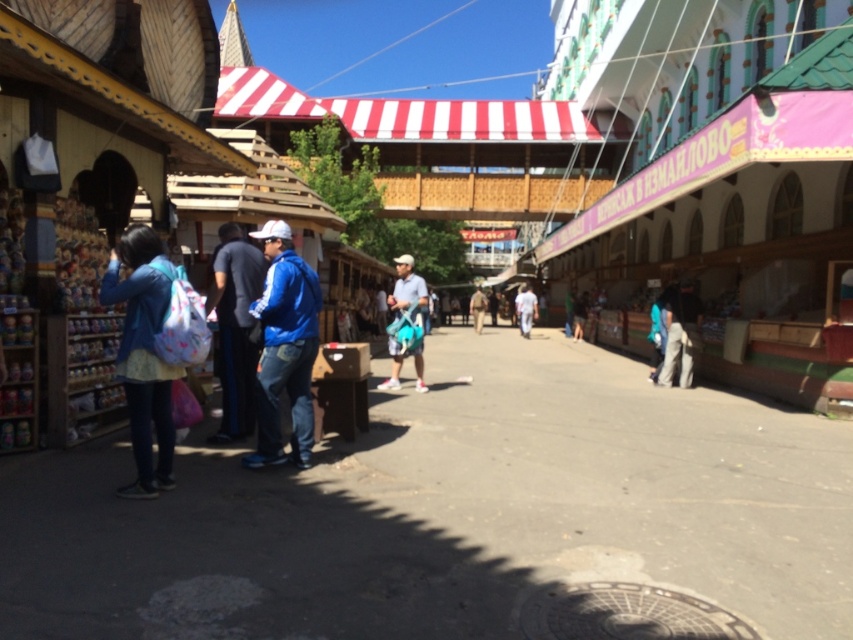
You are a vendor at the market and want to greet both customers wearing the blue fabric jacket at center and the light gray fabric jacket at center. Which customer should you approach first if you are standing at the right side of the walkway?

You should approach the blue fabric jacket at center first because it is to the left of light gray fabric jacket at center, so it is closer to your position on the right side of the walkway.

You are standing at the entrance of the market and see the point marked at coordinates (407, 291). What object is located at that point?

The point at coordinates (407, 291) corresponds to the matte blue shorts at center.

You are navigating through the market and want to reach the point marked as point (x=674, y=323). There is an obstacle at point (x=234, y=250). Can you go around it without passing through the obstacle?

Point (x=234, y=250) is in front of point (x=674, y=323), so you can go around the obstacle at point (x=234, y=250) by moving to either side since it is blocking the path to point (x=674, y=323).